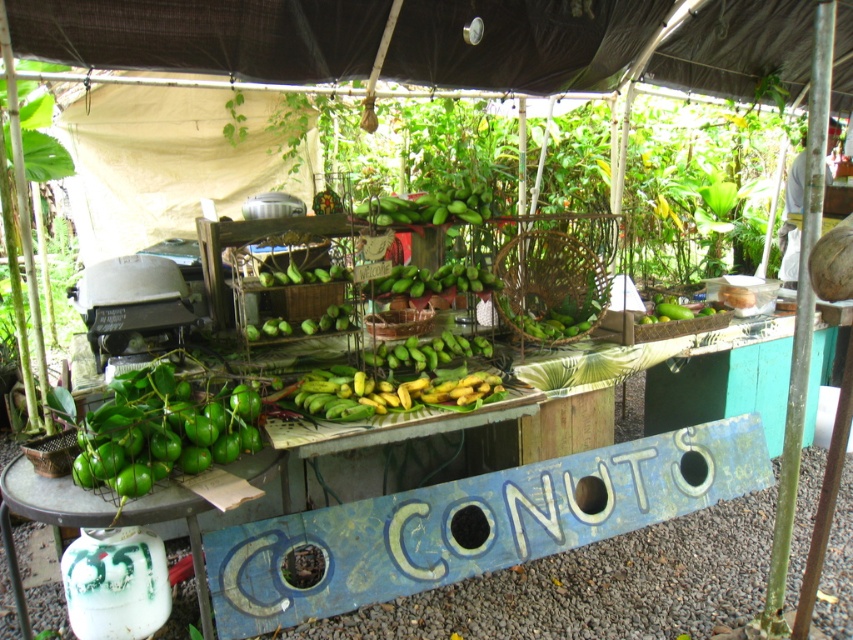
You are a customer at the fruit stall and want to buy the green matte limes at lower left. Where exactly should you look on the stall to find them?

The green matte limes at lower left are located at the coordinates point (160, 433) on the stall.

You are a customer at the fruit stall and want to buy both the green matte fruit basket at lower left and the green matte bananas at center. If you want to carry both items, which one should you place inside the other to make it easier to carry?

The green matte fruit basket at lower left is bigger than the green matte bananas at center, so you can place the green matte bananas at center inside the green matte fruit basket at lower left to carry them easily.

Based on the photo, you are a customer at the fruit stall and want to place a small container between the green matte limes at lower left and the green matte fruit basket at lower left. Can you fit it there?

The green matte limes at lower left has a lesser width compared to green matte fruit basket at lower left, so there is enough space between them to fit a small container.